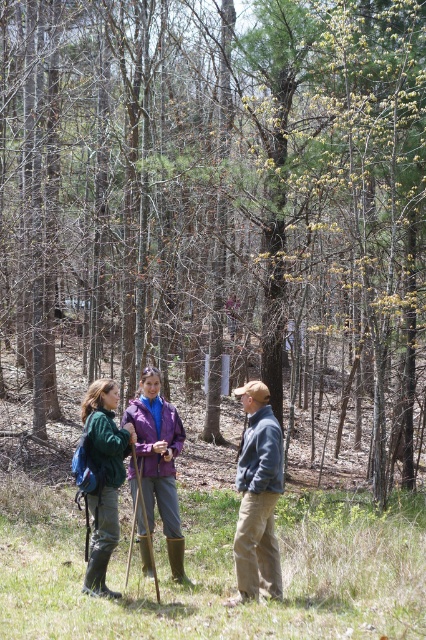
Question: Can you confirm if denim jacket at center is thinner than purple matte jacket at center?

Choices:
 (A) yes
 (B) no

Answer: (A)

Question: Based on their relative distances, which object is nearer to the green fuzzy jacket at lower left?

Choices:
 (A) denim jacket at center
 (B) green fabric jacket at center
 (C) purple matte jacket at center

Answer: (B)

Question: Does green fabric jacket at center have a lesser width compared to purple matte jacket at center?

Choices:
 (A) no
 (B) yes

Answer: (A)

Question: Which point appears closest to the camera in this image?

Choices:
 (A) (270, 424)
 (B) (256, 422)

Answer: (A)

Question: Can you confirm if denim jacket at center is positioned to the left of purple matte jacket at center?

Choices:
 (A) no
 (B) yes

Answer: (A)

Question: Which of the following is the farthest from the observer?

Choices:
 (A) (97, 531)
 (B) (244, 458)

Answer: (B)